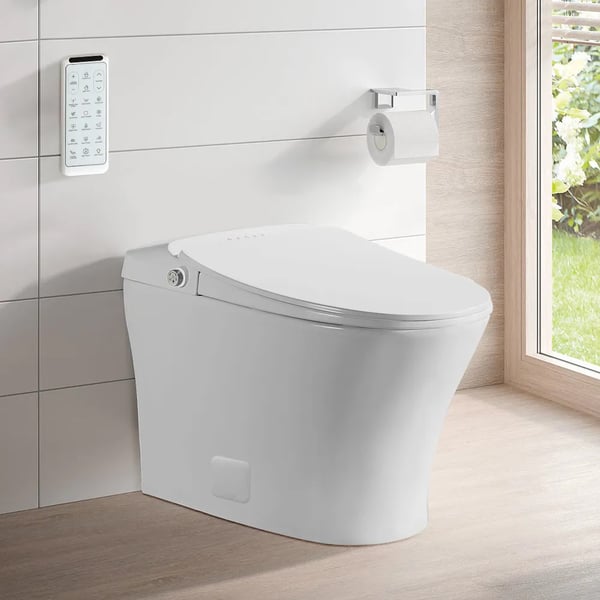
The height and width of the screenshot is (600, 600). Find the location of `toilet roll holder`. toilet roll holder is located at coordinates point(400,92).